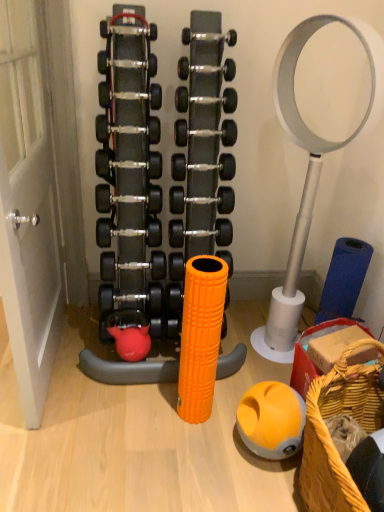
Question: Is silver metallic dumbbell at center, the first dumbbell positioned from the top, far away from woven straw basket at lower right?

Choices:
 (A) no
 (B) yes

Answer: (B)

Question: Does silver metallic dumbbell at center, the 9th dumbbell when ordered from bottom to top, have a larger size compared to woven straw basket at lower right?

Choices:
 (A) yes
 (B) no

Answer: (B)

Question: Is woven straw basket at lower right located within silver metallic dumbbell at center, the 9th dumbbell when ordered from bottom to top?

Choices:
 (A) yes
 (B) no

Answer: (B)

Question: Is silver metallic dumbbell at center, the first dumbbell positioned from the top, taller than woven straw basket at lower right?

Choices:
 (A) yes
 (B) no

Answer: (B)

Question: Considering the relative positions of silver metallic dumbbell at center, the first dumbbell positioned from the top, and woven straw basket at lower right in the image provided, is silver metallic dumbbell at center, the first dumbbell positioned from the top, to the left of woven straw basket at lower right from the viewer's perspective?

Choices:
 (A) yes
 (B) no

Answer: (A)

Question: From the image's perspective, is silver metallic dumbbell at center, the 9th dumbbell when ordered from bottom to top, beneath woven straw basket at lower right?

Choices:
 (A) yes
 (B) no

Answer: (B)

Question: Would you consider black rubber dumbbell at center, the 2th dumbbell from the bottom, to be distant from orange rubber ball at lower center?

Choices:
 (A) no
 (B) yes

Answer: (A)

Question: Is black rubber dumbbell at center, which ranks as the eighth dumbbell in top-to-bottom order, at the left side of orange rubber ball at lower center?

Choices:
 (A) yes
 (B) no

Answer: (A)

Question: Is black rubber dumbbell at center, the 2th dumbbell from the bottom, oriented towards orange rubber ball at lower center?

Choices:
 (A) yes
 (B) no

Answer: (B)

Question: From the image's perspective, is black rubber dumbbell at center, the 2th dumbbell from the bottom, under orange rubber ball at lower center?

Choices:
 (A) yes
 (B) no

Answer: (B)

Question: Would you say black rubber dumbbell at center, the 2th dumbbell from the bottom, is outside orange rubber ball at lower center?

Choices:
 (A) no
 (B) yes

Answer: (B)

Question: From a real-world perspective, is black rubber dumbbell at center, which ranks as the eighth dumbbell in top-to-bottom order, positioned over orange rubber ball at lower center based on gravity?

Choices:
 (A) no
 (B) yes

Answer: (B)

Question: Is black rubber dumbbell at center, the 6th dumbbell viewed from the top, not near white matte door at left?

Choices:
 (A) yes
 (B) no

Answer: (B)